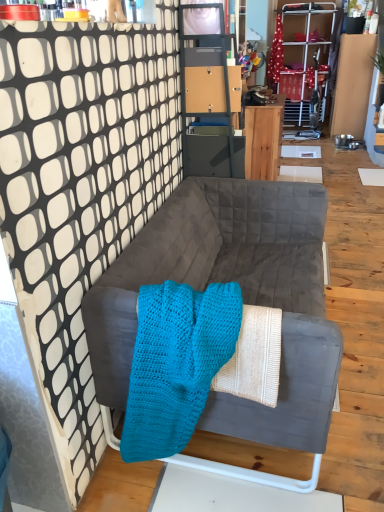
The image size is (384, 512). Find the location of `wooden desk at center`. wooden desk at center is located at coordinates (263, 139).

Is matte gray cabinet at upper center next to turquoise knitted blanket at center?

No, matte gray cabinet at upper center is not next to turquoise knitted blanket at center.

Is matte gray cabinet at upper center bigger or smaller than turquoise knitted blanket at center?

Clearly, matte gray cabinet at upper center is larger in size than turquoise knitted blanket at center.

Would you say matte gray cabinet at upper center contains turquoise knitted blanket at center?

No, turquoise knitted blanket at center is located outside of matte gray cabinet at upper center.

Considering the points (193, 13) and (207, 396), which point is in front, point (193, 13) or point (207, 396)?

The point (207, 396) is closer.

Between matte gray cabinet at upper center and wooden desk at center, which one appears on the left side from the viewer's perspective?

matte gray cabinet at upper center is more to the left.

Who is smaller, matte gray cabinet at upper center or wooden desk at center?

Smaller between the two is matte gray cabinet at upper center.

From the image's perspective, is matte gray cabinet at upper center beneath wooden desk at center?

Yes, from the image's perspective, matte gray cabinet at upper center is beneath wooden desk at center.

Is matte gray cabinet at upper center positioned before wooden desk at center?

Yes, the depth of matte gray cabinet at upper center is less than that of wooden desk at center.

Can you confirm if turquoise knitted blanket at center is smaller than suede gray couch at center?

Yes, turquoise knitted blanket at center is smaller than suede gray couch at center.

From a real-world perspective, which object rests below the other?

suede gray couch at center, from a real-world perspective.

Which object is positioned more to the left, turquoise knitted blanket at center or suede gray couch at center?

turquoise knitted blanket at center.

Can you confirm if turquoise knitted blanket at center is shorter than suede gray couch at center?

Correct, turquoise knitted blanket at center is not as tall as suede gray couch at center.

Would you say wooden desk at center is inside or outside turquoise knitted blanket at center?

wooden desk at center is not enclosed by turquoise knitted blanket at center.

Between wooden desk at center and turquoise knitted blanket at center, which one has larger width?

wooden desk at center is wider.

Does wooden desk at center appear on the left side of turquoise knitted blanket at center?

Incorrect, wooden desk at center is not on the left side of turquoise knitted blanket at center.

Which point is more distant from viewer, (264, 122) or (153, 382)?

Positioned behind is point (264, 122).

This screenshot has height=512, width=384. Identify the location of cabinetry that appears behind the suede gray couch at center. (209, 94).

Is point (192, 29) positioned after point (285, 238)?

No, it is in front of (285, 238).

From a real-world perspective, is matte gray cabinet at upper center positioned under suede gray couch at center based on gravity?

No, from a real-world perspective, matte gray cabinet at upper center is not under suede gray couch at center.

From the image's perspective, between matte gray cabinet at upper center and suede gray couch at center, which one is located above?

matte gray cabinet at upper center is shown above in the image.

Is suede gray couch at center aimed at wooden desk at center?

No, suede gray couch at center is not aimed at wooden desk at center.

Do you think suede gray couch at center is within wooden desk at center, or outside of it?

suede gray couch at center lies outside wooden desk at center.

This screenshot has width=384, height=512. What are the coordinates of `studio couch that appears below the wooden desk at center (from a real-world perspective)` in the screenshot? It's located at (243, 297).

Considering the relative sizes of suede gray couch at center and wooden desk at center in the image provided, is suede gray couch at center bigger than wooden desk at center?

Yes.

Between suede gray couch at center and matte gray cabinet at upper center, which one has less height?

Standing shorter between the two is suede gray couch at center.

Considering the relative positions of suede gray couch at center and matte gray cabinet at upper center in the image provided, is suede gray couch at center to the right of matte gray cabinet at upper center from the viewer's perspective?

Indeed, suede gray couch at center is positioned on the right side of matte gray cabinet at upper center.

Measure the distance from suede gray couch at center to matte gray cabinet at upper center.

suede gray couch at center is 19.70 inches away from matte gray cabinet at upper center.

From a real-world perspective, who is located lower, suede gray couch at center or matte gray cabinet at upper center?

suede gray couch at center, from a real-world perspective.

Where is `cabinetry that is above the turquoise knitted blanket at center (from a real-world perspective)`? The height and width of the screenshot is (512, 384). cabinetry that is above the turquoise knitted blanket at center (from a real-world perspective) is located at coordinates (209, 94).

The image size is (384, 512). In the image, there is a matte gray cabinet at upper center. In order to click on desk above it (from the image's perspective) in this screenshot , I will do tap(263, 139).

Estimate the real-world distances between objects in this image. Which object is further from matte gray cabinet at upper center, turquoise knitted blanket at center or wooden desk at center?

wooden desk at center is positioned further to the anchor matte gray cabinet at upper center.

From the picture: Based on their spatial positions, is turquoise knitted blanket at center or wooden desk at center closer to suede gray couch at center?

turquoise knitted blanket at center is positioned closer to the anchor suede gray couch at center.

In the scene shown: When comparing their distances from turquoise knitted blanket at center, does matte gray cabinet at upper center or suede gray couch at center seem closer?

suede gray couch at center is positioned closer to the anchor turquoise knitted blanket at center.

Which object lies further to the anchor point matte gray cabinet at upper center, suede gray couch at center or turquoise knitted blanket at center?

Among the two, turquoise knitted blanket at center is located further to matte gray cabinet at upper center.

Based on their spatial positions, is matte gray cabinet at upper center or turquoise knitted blanket at center further from wooden desk at center?

turquoise knitted blanket at center is positioned further to the anchor wooden desk at center.

Considering their positions, is wooden desk at center positioned closer to matte gray cabinet at upper center than suede gray couch at center?

suede gray couch at center.

When comparing their distances from turquoise knitted blanket at center, does suede gray couch at center or matte gray cabinet at upper center seem further?

matte gray cabinet at upper center is positioned further to the anchor turquoise knitted blanket at center.

Which object lies nearer to the anchor point wooden desk at center, suede gray couch at center or matte gray cabinet at upper center?

matte gray cabinet at upper center is closer to wooden desk at center.

Where is `studio couch between turquoise knitted blanket at center and wooden desk at center along the z-axis`? The height and width of the screenshot is (512, 384). studio couch between turquoise knitted blanket at center and wooden desk at center along the z-axis is located at coordinates (243, 297).

I want to click on cabinetry between suede gray couch at center and wooden desk at center from front to back, so click(209, 94).

This screenshot has height=512, width=384. What are the coordinates of `cabinetry positioned between turquoise knitted blanket at center and wooden desk at center from near to far` in the screenshot? It's located at (209, 94).

What are the coordinates of `studio couch that lies between matte gray cabinet at upper center and turquoise knitted blanket at center from top to bottom` in the screenshot? It's located at (243, 297).